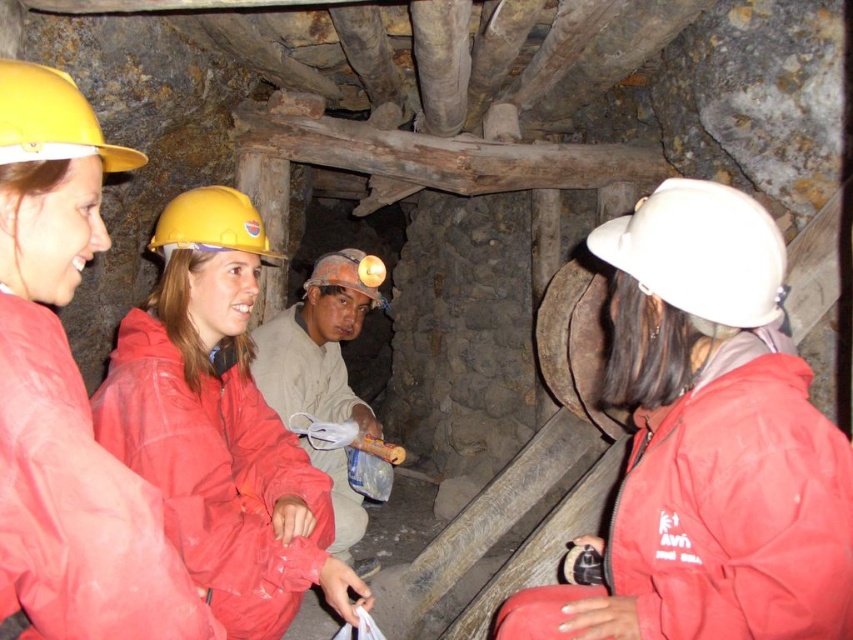
Can you confirm if matte red jacket at upper left is positioned to the left of yellow matte helmet at center?

In fact, matte red jacket at upper left is to the right of yellow matte helmet at center.

Image resolution: width=853 pixels, height=640 pixels. What do you see at coordinates (67, 394) in the screenshot?
I see `matte red jacket at upper left` at bounding box center [67, 394].

The width and height of the screenshot is (853, 640). In order to click on matte red jacket at upper left in this screenshot , I will do `click(67, 394)`.

Is the position of matte white helmet at center less distant than that of matte red jacket at center?

Yes, it is in front of matte red jacket at center.

Does matte white helmet at center appear on the left side of matte red jacket at center?

Incorrect, matte white helmet at center is not on the left side of matte red jacket at center.

Who is more distant from viewer, [750,580] or [318,576]?

The point [318,576] is behind.

Locate an element on the screen. matte white helmet at center is located at coordinates (708, 444).

Who is taller, matte gray helmet at center or yellow matte helmet at upper left?

matte gray helmet at center

Can you confirm if matte gray helmet at center is positioned below yellow matte helmet at upper left?

Indeed, matte gray helmet at center is positioned under yellow matte helmet at upper left.

Is point (276, 404) positioned in front of point (68, 129)?

No, (276, 404) is further to viewer.

Identify the location of matte gray helmet at center. The image size is (853, 640). (318, 344).